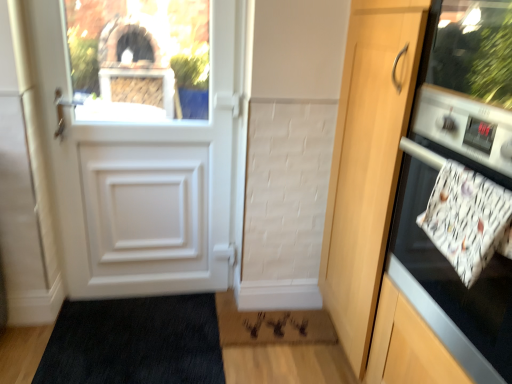
Question: Would you say rug with textured pile at lower center is outside matte glass window screen at upper left?

Choices:
 (A) no
 (B) yes

Answer: (B)

Question: From the image's perspective, is rug with textured pile at lower center above matte glass window screen at upper left?

Choices:
 (A) yes
 (B) no

Answer: (B)

Question: Considering the relative sizes of rug with textured pile at lower center and matte glass window screen at upper left in the image provided, is rug with textured pile at lower center thinner than matte glass window screen at upper left?

Choices:
 (A) no
 (B) yes

Answer: (A)

Question: Is rug with textured pile at lower center oriented away from matte glass window screen at upper left?

Choices:
 (A) yes
 (B) no

Answer: (B)

Question: Can matte glass window screen at upper left be found inside rug with textured pile at lower center?

Choices:
 (A) yes
 (B) no

Answer: (B)

Question: Is rug with textured pile at lower center to the right of matte glass window screen at upper left from the viewer's perspective?

Choices:
 (A) no
 (B) yes

Answer: (B)

Question: Is wooden door at right further to the viewer compared to white glossy oven at right?

Choices:
 (A) yes
 (B) no

Answer: (B)

Question: From the image's perspective, is wooden door at right on white glossy oven at right?

Choices:
 (A) yes
 (B) no

Answer: (B)

Question: Is white glossy oven at right a part of wooden door at right?

Choices:
 (A) yes
 (B) no

Answer: (A)

Question: Is wooden door at right positioned with its back to white glossy oven at right?

Choices:
 (A) yes
 (B) no

Answer: (A)

Question: From a real-world perspective, is wooden door at right on white glossy oven at right?

Choices:
 (A) no
 (B) yes

Answer: (A)

Question: Is wooden door at right aimed at white glossy oven at right?

Choices:
 (A) no
 (B) yes

Answer: (B)

Question: Is rug with textured pile at lower center in front of wooden door at right?

Choices:
 (A) no
 (B) yes

Answer: (A)